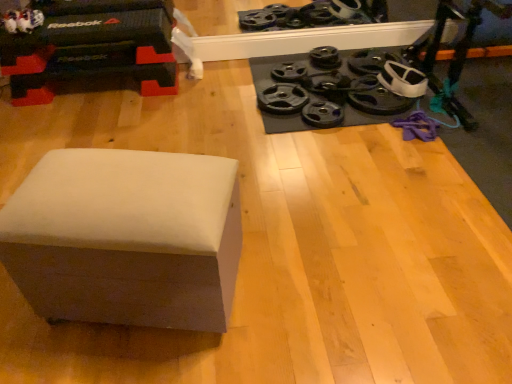
Identify the location of black rubber weight plate at upper right, positioned as the 7th wheel in left-to-right order. (370, 61).

In order to face white plush toy at upper left, should I rotate leftwards or rightwards?

Rotate left and turn 28.469 degrees.

The image size is (512, 384). Find the location of `black rubber weight plate at upper right, the 6th wheel in the left-to-right sequence`. black rubber weight plate at upper right, the 6th wheel in the left-to-right sequence is located at coordinates (376, 97).

Does point (335, 71) come behind point (280, 69)?

No, it is in front of (280, 69).

Considering the sizes of black rubber weight plate at upper right, acting as the 4th wheel starting from the right, and black rubber weight plate at upper right, which is counted as the 6th wheel, starting from the right, in the image, is black rubber weight plate at upper right, acting as the 4th wheel starting from the right, bigger or smaller than black rubber weight plate at upper right, which is counted as the 6th wheel, starting from the right,?

Clearly, black rubber weight plate at upper right, acting as the 4th wheel starting from the right, is smaller in size than black rubber weight plate at upper right, which is counted as the 6th wheel, starting from the right.

Based on the photo, from a real-world perspective, is black rubber weight plate at upper right, the 4th wheel when ordered from left to right, over black rubber weight plate at upper right, which is counted as the 6th wheel, starting from the right?

Yes.

How much distance is there between black rubber weight plate at upper right, the 4th wheel when ordered from left to right, and black rubber weight plate at upper right, which is counted as the 6th wheel, starting from the right?

A distance of 6.80 inches exists between black rubber weight plate at upper right, the 4th wheel when ordered from left to right, and black rubber weight plate at upper right, which is counted as the 6th wheel, starting from the right.

Between black rubber weight plate at center-right, which is the fifth wheel from right to left, and black rubber weight plate at upper center, which ranks as the third wheel in right-to-left order, which one appears on the right side from the viewer's perspective?

Positioned to the right is black rubber weight plate at upper center, which ranks as the third wheel in right-to-left order.

Which of these two, black rubber weight plate at center-right, the 3th wheel positioned from the left, or black rubber weight plate at upper center, acting as the 5th wheel starting from the left, stands shorter?

Standing shorter between the two is black rubber weight plate at center-right, the 3th wheel positioned from the left.

Find the location of a particular element. the 6th wheel in front of the black rubber weight plate at upper center, acting as the 5th wheel starting from the left is located at coordinates (322, 114).

Is black rubber weight plate at upper center, which ranks as the third wheel in right-to-left order, inside black rubber weight plate at center-right, the 3th wheel positioned from the left?

No.

Between black rubber weight plate at center-right, which is the fifth wheel from right to left, and black rubber weight plate at center-right, the 1th wheel positioned from the left, which one has more height?

Standing taller between the two is black rubber weight plate at center-right, the 1th wheel positioned from the left.

Can we say black rubber weight plate at center-right, the 3th wheel positioned from the left, lies outside black rubber weight plate at center-right, the 1th wheel positioned from the left?

→ That's correct, black rubber weight plate at center-right, the 3th wheel positioned from the left, is outside of black rubber weight plate at center-right, the 1th wheel positioned from the left.

From a real-world perspective, is black rubber weight plate at center-right, the 3th wheel positioned from the left, positioned above or below black rubber weight plate at center-right, the 1th wheel positioned from the left?

Clearly, from a real-world perspective, black rubber weight plate at center-right, the 3th wheel positioned from the left, is below black rubber weight plate at center-right, the 1th wheel positioned from the left.

Consider the image. Could you tell me if black rubber weight plate at center-right, the 3th wheel positioned from the left, is turned towards black rubber weight plate at center-right, placed as the seventh wheel when sorted from right to left?

No, black rubber weight plate at center-right, the 3th wheel positioned from the left, does not turn towards black rubber weight plate at center-right, placed as the seventh wheel when sorted from right to left.

Can you tell me how much black rubber weight plate at upper right, the 1th wheel positioned from the right, and black rubber weight plate at upper right, acting as the 2th wheel starting from the left, differ in facing direction?

The angle between the facing direction of black rubber weight plate at upper right, the 1th wheel positioned from the right, and the facing direction of black rubber weight plate at upper right, acting as the 2th wheel starting from the left, is 1.39 degrees.

Which is closer, (367, 69) or (281, 73)?

Point (367, 69) is closer to the camera than point (281, 73).

In the scene shown: Considering the relative sizes of black rubber weight plate at upper right, positioned as the 7th wheel in left-to-right order, and black rubber weight plate at upper right, acting as the 2th wheel starting from the left, in the image provided, is black rubber weight plate at upper right, positioned as the 7th wheel in left-to-right order, thinner than black rubber weight plate at upper right, acting as the 2th wheel starting from the left,?

No.

From the image's perspective, between black rubber weight plate at upper right, the 1th wheel positioned from the right, and black rubber weight plate at upper right, acting as the 2th wheel starting from the left, who is located below?

black rubber weight plate at upper right, acting as the 2th wheel starting from the left, is shown below in the image.

Is white plush toy at upper left thinner than black rubber weight plate at upper right, positioned as the 2th wheel in right-to-left order?

Yes, white plush toy at upper left is thinner than black rubber weight plate at upper right, positioned as the 2th wheel in right-to-left order.

Is white plush toy at upper left touching black rubber weight plate at upper right, the 6th wheel in the left-to-right sequence?

No, white plush toy at upper left is not in contact with black rubber weight plate at upper right, the 6th wheel in the left-to-right sequence.

Based on the photo, from the image's perspective, relative to black rubber weight plate at upper right, positioned as the 2th wheel in right-to-left order, is white plush toy at upper left above or below?

Clearly, from the image's perspective, white plush toy at upper left is above black rubber weight plate at upper right, positioned as the 2th wheel in right-to-left order.

From a real-world perspective, does white plush toy at upper left sit lower than black rubber weight plate at upper right, the 6th wheel in the left-to-right sequence?

No, from a real-world perspective, white plush toy at upper left is not under black rubber weight plate at upper right, the 6th wheel in the left-to-right sequence.

From a real-world perspective, relative to black rubber weight plate at upper right, the 1th wheel positioned from the right, is white matte ottoman at lower left vertically above or below?

white matte ottoman at lower left is situated higher than black rubber weight plate at upper right, the 1th wheel positioned from the right, in the real world.

There is a black rubber weight plate at upper right, positioned as the 7th wheel in left-to-right order. Where is `furniture above it (from a real-world perspective)`? The image size is (512, 384). furniture above it (from a real-world perspective) is located at coordinates (126, 238).

Is white matte ottoman at lower left far from black rubber weight plate at upper right, the 1th wheel positioned from the right?

Yes, white matte ottoman at lower left and black rubber weight plate at upper right, the 1th wheel positioned from the right, are located far from each other.

Between white matte ottoman at lower left and black rubber weight plate at upper right, the 1th wheel positioned from the right, which one has smaller size?

Smaller between the two is black rubber weight plate at upper right, the 1th wheel positioned from the right.

From a real-world perspective, which object stands above the other?

In real-world perspective, black rubber weight plate at upper right, the 6th wheel in the left-to-right sequence, is above.

Is black rubber weight plate at upper right, positioned as the 2th wheel in right-to-left order, to the right of black rubber weight plate at upper right, which is counted as the 6th wheel, starting from the right, from the viewer's perspective?

Yes.

Can you confirm if black rubber weight plate at upper right, positioned as the 2th wheel in right-to-left order, is bigger than black rubber weight plate at upper right, acting as the 2th wheel starting from the left?

Yes.

From the black rubber weight plate at upper right, the 4th wheel when ordered from left to right, count 2nd wheels backward and point to it. Please provide its 2D coordinates.

[(289, 72)]

Locate an element on the screen. The width and height of the screenshot is (512, 384). the 2nd wheel counting from the left side of the black rubber weight plate at upper center, which ranks as the third wheel in right-to-left order is located at coordinates (322, 114).

Estimate the real-world distances between objects in this image. Which object is closer to black rubber weight plate at center-right, the 1th wheel positioned from the left, black rubber weight plate at upper right, positioned as the 7th wheel in left-to-right order, or white matte ottoman at lower left?

The object closer to black rubber weight plate at center-right, the 1th wheel positioned from the left, is black rubber weight plate at upper right, positioned as the 7th wheel in left-to-right order.

Based on their spatial positions, is black rubber weight plate at center-right, the 1th wheel positioned from the left, or black rubber weight plate at upper right, the 6th wheel in the left-to-right sequence, closer to black rubber weight plate at upper right, which is counted as the 6th wheel, starting from the right?

Among the two, black rubber weight plate at center-right, the 1th wheel positioned from the left, is located nearer to black rubber weight plate at upper right, which is counted as the 6th wheel, starting from the right.

From the image, which object appears to be nearer to white plush toy at upper left, white matte ottoman at lower left or black rubber weight plate at upper right, positioned as the 2th wheel in right-to-left order?

Among the two, white matte ottoman at lower left is located nearer to white plush toy at upper left.

When comparing their distances from white plush toy at upper left, does black rubber weight plate at upper right, acting as the 2th wheel starting from the left, or black rubber weight plate at upper right, positioned as the 2th wheel in right-to-left order, seem further?

black rubber weight plate at upper right, positioned as the 2th wheel in right-to-left order, is positioned further to the anchor white plush toy at upper left.

Which object lies nearer to the anchor point black rubber weight plate at upper right, positioned as the 7th wheel in left-to-right order, black rubber weight plate at upper right, which is counted as the 6th wheel, starting from the right, or black rubber weight plate at upper right, the 6th wheel in the left-to-right sequence?

black rubber weight plate at upper right, the 6th wheel in the left-to-right sequence, is closer to black rubber weight plate at upper right, positioned as the 7th wheel in left-to-right order.

Which object lies nearer to the anchor point black rubber weight plate at upper right, the 4th wheel when ordered from left to right, black rubber weight plate at center-right, which is the fifth wheel from right to left, or white matte ottoman at lower left?

black rubber weight plate at center-right, which is the fifth wheel from right to left.

Considering their positions, is black rubber weight plate at upper right, the 4th wheel when ordered from left to right, positioned closer to black rubber weight plate at upper right, the 6th wheel in the left-to-right sequence, than black rubber weight plate at upper right, positioned as the 7th wheel in left-to-right order?

black rubber weight plate at upper right, the 4th wheel when ordered from left to right, is positioned closer to the anchor black rubber weight plate at upper right, the 6th wheel in the left-to-right sequence.

Looking at the image, which one is located closer to black rubber weight plate at upper right, the 4th wheel when ordered from left to right, black rubber weight plate at upper right, which is counted as the 6th wheel, starting from the right, or black rubber weight plate at upper right, the 6th wheel in the left-to-right sequence?

The object closer to black rubber weight plate at upper right, the 4th wheel when ordered from left to right, is black rubber weight plate at upper right, which is counted as the 6th wheel, starting from the right.

The height and width of the screenshot is (384, 512). I want to click on wheel between white plush toy at upper left and black rubber weight plate at upper right, which is counted as the 6th wheel, starting from the right, from left to right, so point(282,99).

You are a GUI agent. You are given a task and a screenshot of the screen. Output one action in this format:
    pyautogui.click(x=<x>, y=<y>)
    Task: Click on the toy between white matte ottoman at lower left and black rubber weight plate at upper center, which ranks as the third wheel in right-to-left order, in the front-back direction
    This screenshot has width=512, height=384.
    Given the screenshot: What is the action you would take?
    pyautogui.click(x=22, y=20)

Locate an element on the screen. Image resolution: width=512 pixels, height=384 pixels. furniture between white plush toy at upper left and black rubber weight plate at center-right, the 3th wheel positioned from the left is located at coordinates (126, 238).

This screenshot has width=512, height=384. In order to click on wheel located between white matte ottoman at lower left and black rubber weight plate at upper right, the 6th wheel in the left-to-right sequence, in the depth direction in this screenshot , I will do (x=322, y=114).